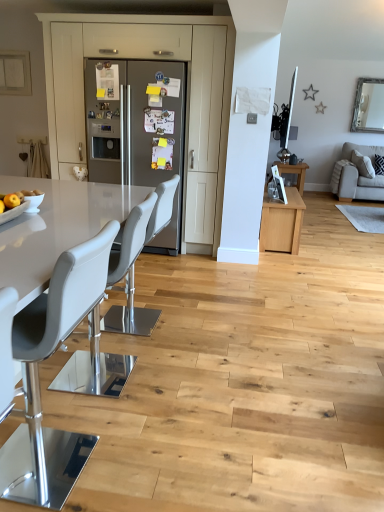
I want to click on unoccupied region to the right of white leather chair at center, the 1th chair viewed from the back, so click(x=195, y=327).